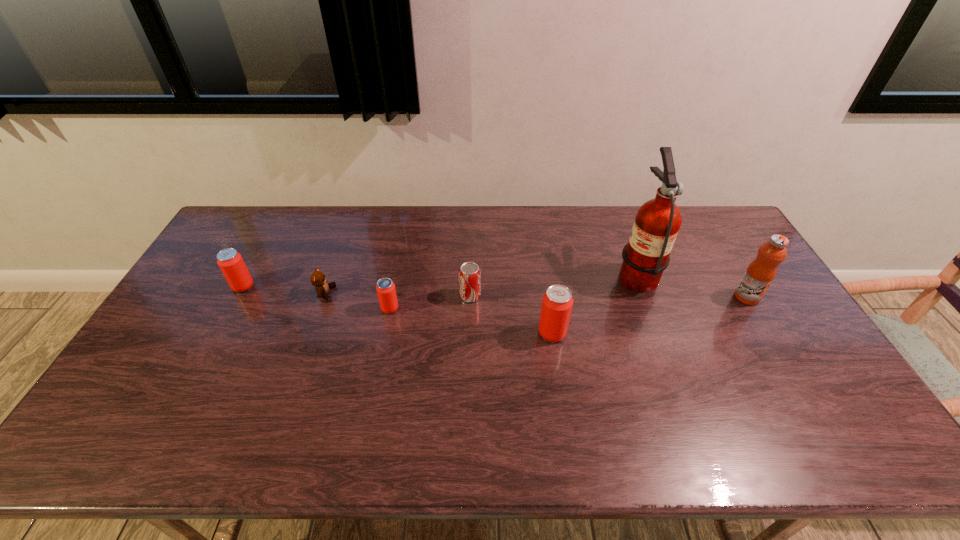
Find the location of a particular element. The image size is (960, 540). free space that satisfies the following two spatial constraints: 1. on the front-facing side of the teddy bear; 2. on the left side of the rightmost beer can is located at coordinates (312, 333).

I want to click on free space that satisfies the following two spatial constraints: 1. on the front-facing side of the shortest object; 2. on the left side of the soda can, so click(x=324, y=296).